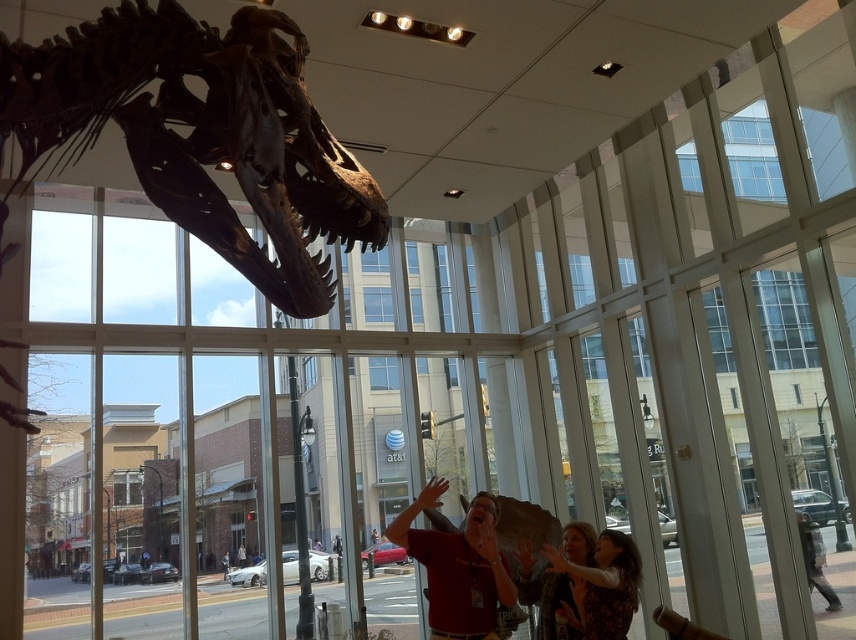
Is matte red shirt at center bigger than matte black shirt at center?

No.

Does matte red shirt at center have a greater width compared to matte black shirt at center?

Correct, the width of matte red shirt at center exceeds that of matte black shirt at center.

Where is `matte red shirt at center`? matte red shirt at center is located at coordinates point(456,564).

In order to click on matte red shirt at center in this screenshot , I will do `click(456, 564)`.

From the picture: Can you confirm if matte red shirt at center is wider than dark gray jacket at lower right?

Yes, matte red shirt at center is wider than dark gray jacket at lower right.

Is matte red shirt at center taller than dark gray jacket at lower right?

Yes.

You are a GUI agent. You are given a task and a screenshot of the screen. Output one action in this format:
    pyautogui.click(x=<x>, y=<y>)
    Task: Click on the matte red shirt at center
    This screenshot has width=856, height=640.
    Given the screenshot: What is the action you would take?
    (x=456, y=564)

Is matte brown hair at lower right positioned before matte black shirt at center?

Yes.

Is point (580, 605) positioned before point (545, 634)?

Yes, it is.

Find the location of a particular element. The height and width of the screenshot is (640, 856). matte brown hair at lower right is located at coordinates (603, 584).